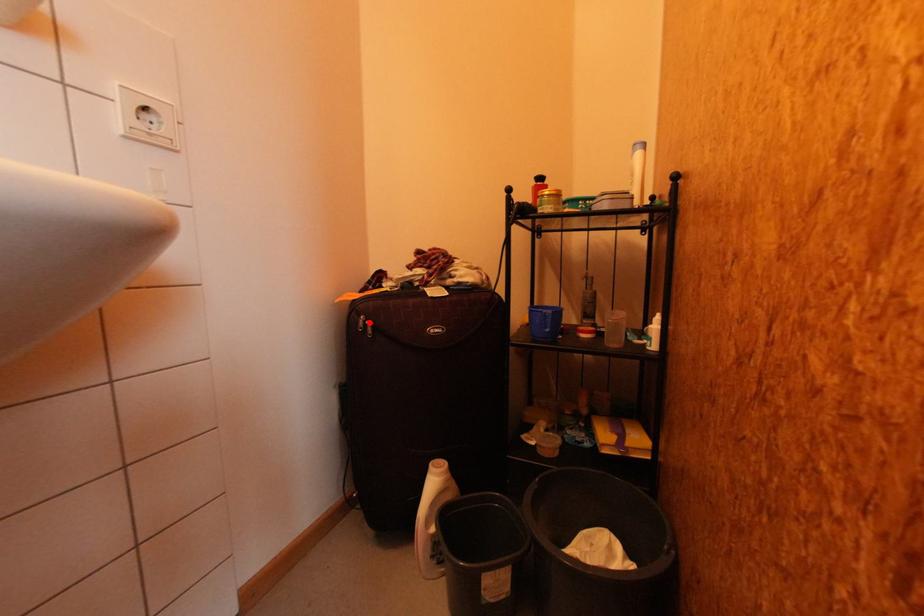
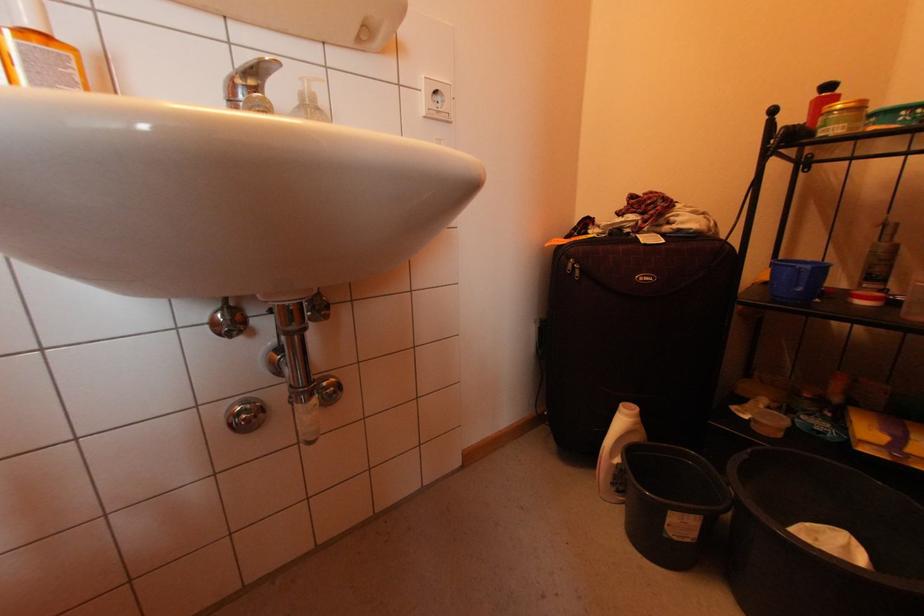
Where in the second image is the point corresponding to the highlighted location from the first image?

(578, 265)